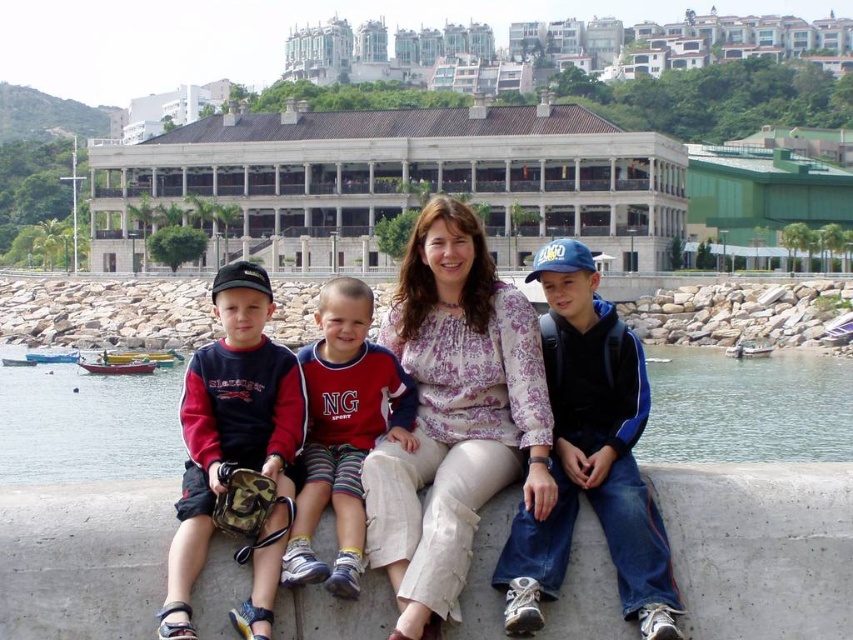
Question: Which point is farther to the camera?

Choices:
 (A) (233, 280)
 (B) (503, 291)
 (C) (410, 570)

Answer: (B)

Question: Can you confirm if matte blue jacket at center is positioned to the right of light purple floral blouse at center?

Choices:
 (A) yes
 (B) no

Answer: (A)

Question: Does light purple floral blouse at center appear on the right side of clear water at lower center?

Choices:
 (A) yes
 (B) no

Answer: (A)

Question: Which of these objects is positioned farthest from the blue denim jeans at center?

Choices:
 (A) clear water at lower center
 (B) light purple floral blouse at center
 (C) matte blue jacket at center
 (D) striped cotton shorts at center

Answer: (A)

Question: Does dark blue fleece jacket at center appear on the right side of striped cotton shorts at center?

Choices:
 (A) yes
 (B) no

Answer: (A)

Question: Which point appears farthest from the camera in this image?

Choices:
 (A) (253, 468)
 (B) (456, 305)
 (C) (341, 584)

Answer: (B)